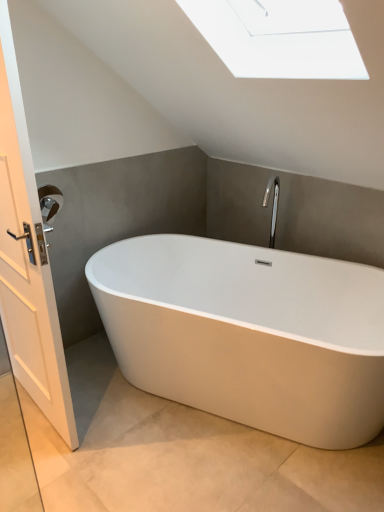
Find the location of `white wooden door at left`. white wooden door at left is located at coordinates (28, 269).

What is the approximate height of brushed metal towel bar at left?

The height of brushed metal towel bar at left is 7.35 inches.

Find the location of `white wooden door at left`. white wooden door at left is located at coordinates (28, 269).

Is brushed metal towel bar at left not within white wooden door at left?

Yes.

Is brushed metal towel bar at left bigger than white wooden door at left?

Actually, brushed metal towel bar at left might be smaller than white wooden door at left.

Is brushed metal towel bar at left aimed at white glossy bathtub at center?

No, brushed metal towel bar at left does not turn towards white glossy bathtub at center.

Considering the sizes of brushed metal towel bar at left and white glossy bathtub at center in the image, is brushed metal towel bar at left taller or shorter than white glossy bathtub at center?

Considering their sizes, brushed metal towel bar at left has less height than white glossy bathtub at center.

Is brushed metal towel bar at left far away from white glossy bathtub at center?

brushed metal towel bar at left is near white glossy bathtub at center, not far away.

Which of these two, white wooden door at left or white glossy bathtub at center, is wider?

With larger width is white glossy bathtub at center.

At what (x,y) coordinates should I click in order to perform the action: click on screen door lying above the white glossy bathtub at center (from the image's perspective). Please return your answer as a coordinate pair (x, y). Looking at the image, I should click on (28, 269).

Can brushed metal towel bar at left be found inside white glossy bathtub at center?

No.

From the image's perspective, is white glossy bathtub at center on top of brushed metal towel bar at left?

Actually, white glossy bathtub at center appears below brushed metal towel bar at left in the image.

Is there a large distance between white glossy bathtub at center and brushed metal towel bar at left?

No, white glossy bathtub at center is in close proximity to brushed metal towel bar at left.

Does point (201, 297) come behind point (56, 198)?

Yes.

Considering their positions, is white wooden door at left located in front of or behind brushed metal towel bar at left?

Clearly, white wooden door at left is in front of brushed metal towel bar at left.

How much distance is there between white wooden door at left and brushed metal towel bar at left?

17.10 inches.

From the image's perspective, which is below, white wooden door at left or brushed metal towel bar at left?

white wooden door at left appears lower in the image.

Is white wooden door at left facing away from brushed metal towel bar at left?

Absolutely, white wooden door at left is directed away from brushed metal towel bar at left.

Is white glossy bathtub at center wider or thinner than white wooden door at left?

In the image, white glossy bathtub at center appears to be wider than white wooden door at left.

Does white glossy bathtub at center have a larger size compared to white wooden door at left?

Correct, white glossy bathtub at center is larger in size than white wooden door at left.

Based on the photo, would you consider white glossy bathtub at center to be distant from white wooden door at left?

Actually, white glossy bathtub at center and white wooden door at left are a little close together.

You are a GUI agent. You are given a task and a screenshot of the screen. Output one action in this format:
    pyautogui.click(x=<x>, y=<y>)
    Task: Click on the screen door below the brushed metal towel bar at left (from the image's perspective)
    The image size is (384, 512).
    Given the screenshot: What is the action you would take?
    pyautogui.click(x=28, y=269)

You are a GUI agent. You are given a task and a screenshot of the screen. Output one action in this format:
    pyautogui.click(x=<x>, y=<y>)
    Task: Click on the towel bar behind the white glossy bathtub at center
    
    Given the screenshot: What is the action you would take?
    pyautogui.click(x=49, y=204)

Based on their spatial positions, is brushed metal towel bar at left or white glossy bathtub at center closer to white wooden door at left?

brushed metal towel bar at left is positioned closer to the anchor white wooden door at left.

When comparing their distances from white wooden door at left, does white glossy bathtub at center or brushed metal towel bar at left seem further?

white glossy bathtub at center is positioned further to the anchor white wooden door at left.

Considering their positions, is white glossy bathtub at center positioned closer to brushed metal towel bar at left than white wooden door at left?

white wooden door at left.

From the picture: When comparing their distances from brushed metal towel bar at left, does white wooden door at left or white glossy bathtub at center seem closer?

Among the two, white wooden door at left is located nearer to brushed metal towel bar at left.

From the image, which object appears to be farther from white glossy bathtub at center, white wooden door at left or brushed metal towel bar at left?

brushed metal towel bar at left.

Estimate the real-world distances between objects in this image. Which object is further from white glossy bathtub at center, brushed metal towel bar at left or white wooden door at left?

The object further to white glossy bathtub at center is brushed metal towel bar at left.

Identify the location of towel bar between white wooden door at left and white glossy bathtub at center in the horizontal direction. The width and height of the screenshot is (384, 512). (49, 204).